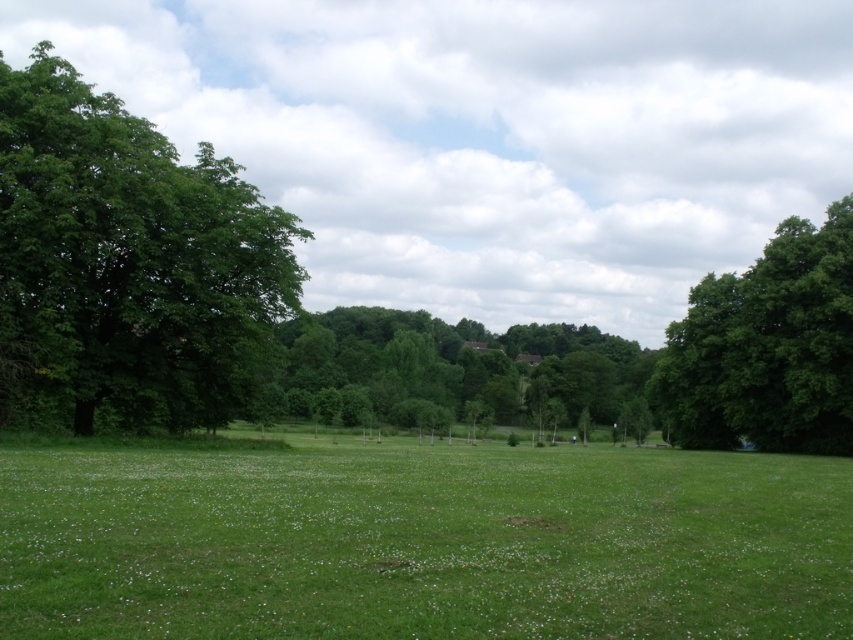
You are standing in the middle of the green grassy field at center and want to walk towards the green leafy tree at left. Which direction should you head?

You should head to the left because the green grassy field at center is to the right of the green leafy tree at left, so moving left will take you towards the tree.

You are standing in the grassy field and see the green leafy tree at right and the green leafy tree at center. Which tree is closer to the ground?

The green leafy tree at right is below the green leafy tree at center, so it is closer to the ground.